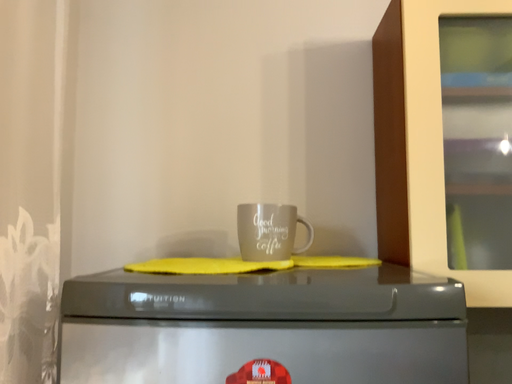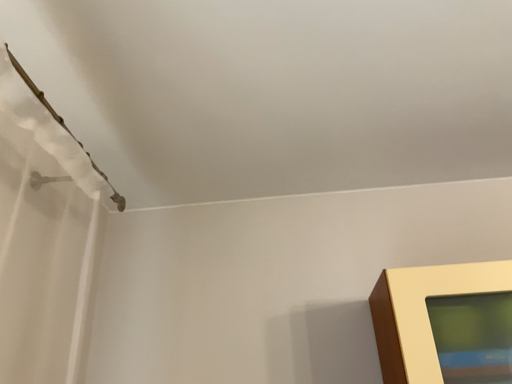
Question: Which way did the camera rotate in the video?

Choices:
 (A) rotated downward
 (B) rotated upward

Answer: (B)